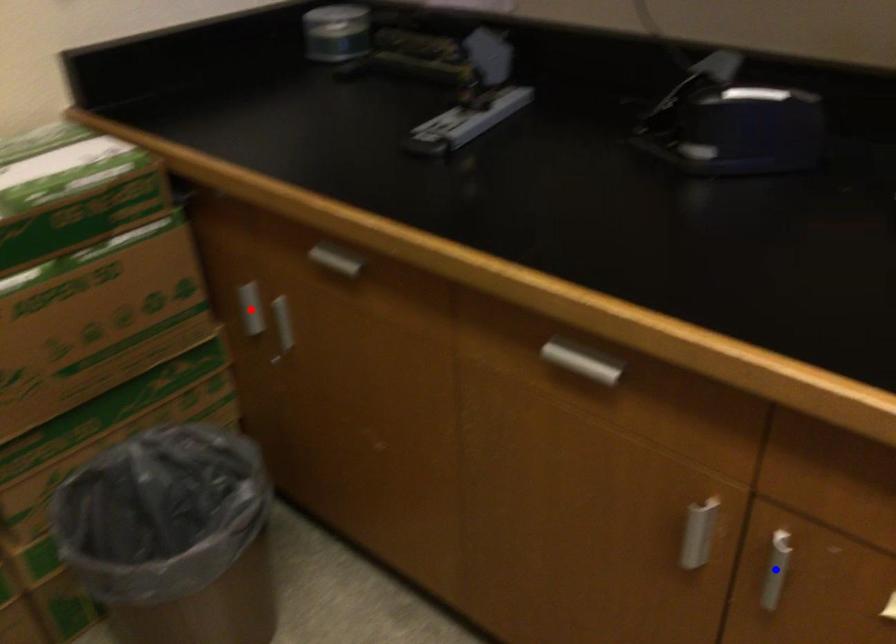
Question: Which of the two points in the image is closer to the camera?

Choices:
 (A) Blue point is closer.
 (B) Red point is closer.

Answer: (A)